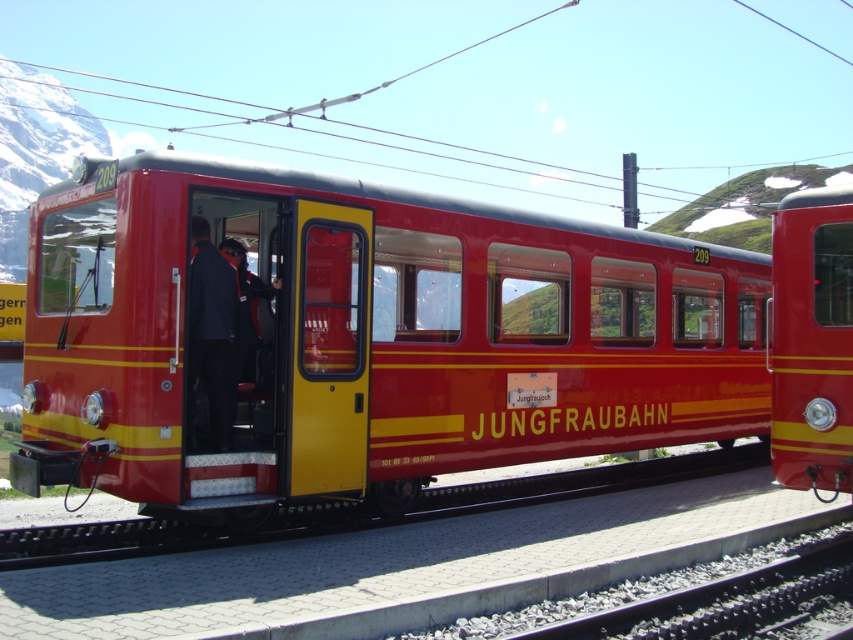
Does metallic red train at right appear under dark blue uniform at center?

Indeed, metallic red train at right is positioned under dark blue uniform at center.

Which is behind, point (785, 433) or point (225, 305)?

Point (785, 433)

This screenshot has width=853, height=640. Describe the element at coordinates (811, 340) in the screenshot. I see `metallic red train at right` at that location.

In order to click on metallic red train at right in this screenshot , I will do [811, 340].

At what (x,y) coordinates should I click in order to perform the action: click on matte red train car at center. Please return your answer as a coordinate pair (x, y). The width and height of the screenshot is (853, 640). Looking at the image, I should click on (370, 336).

Does matte red train car at center have a larger size compared to dark blue uniform at center?

Yes, matte red train car at center is bigger than dark blue uniform at center.

Find the location of a particular element. matte red train car at center is located at coordinates (370, 336).

This screenshot has width=853, height=640. Find the location of `matte red train car at center`. matte red train car at center is located at coordinates (370, 336).

Can you confirm if matte red train car at center is positioned to the left of metallic red train at right?

Indeed, matte red train car at center is positioned on the left side of metallic red train at right.

Which is above, matte red train car at center or metallic red train at right?

metallic red train at right is higher up.

Identify the location of matte red train car at center. (x=370, y=336).